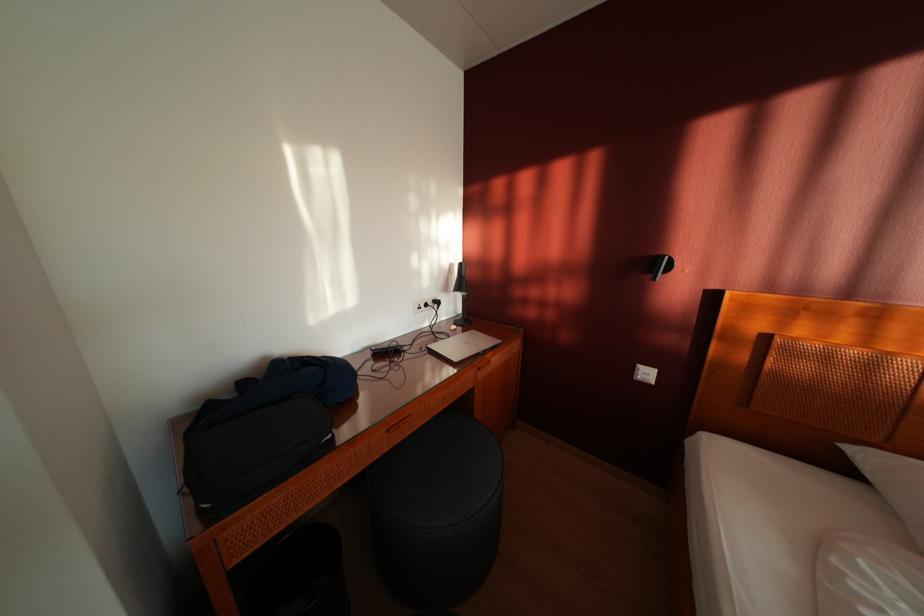
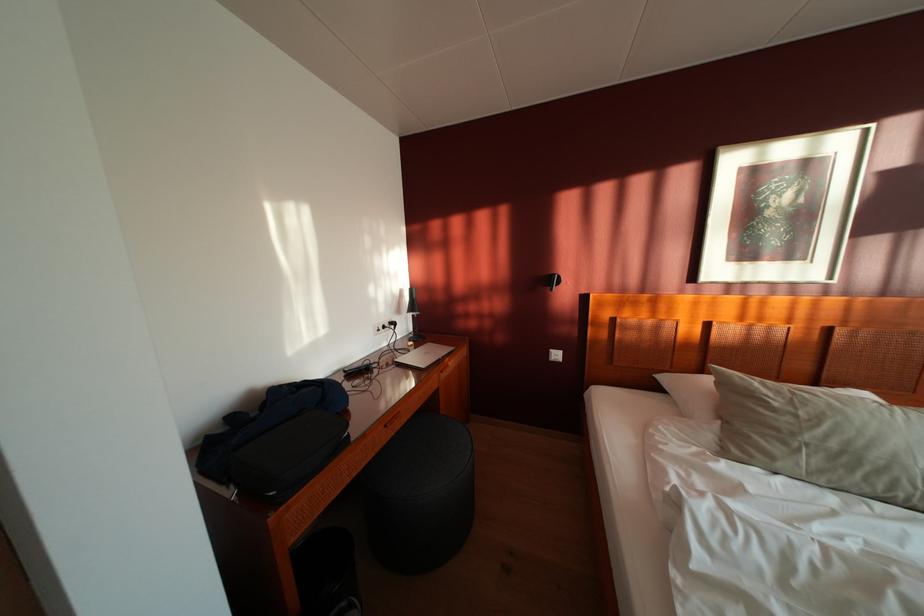
In the second image, find the point that corresponds to (x=468, y=315) in the first image.

(419, 334)